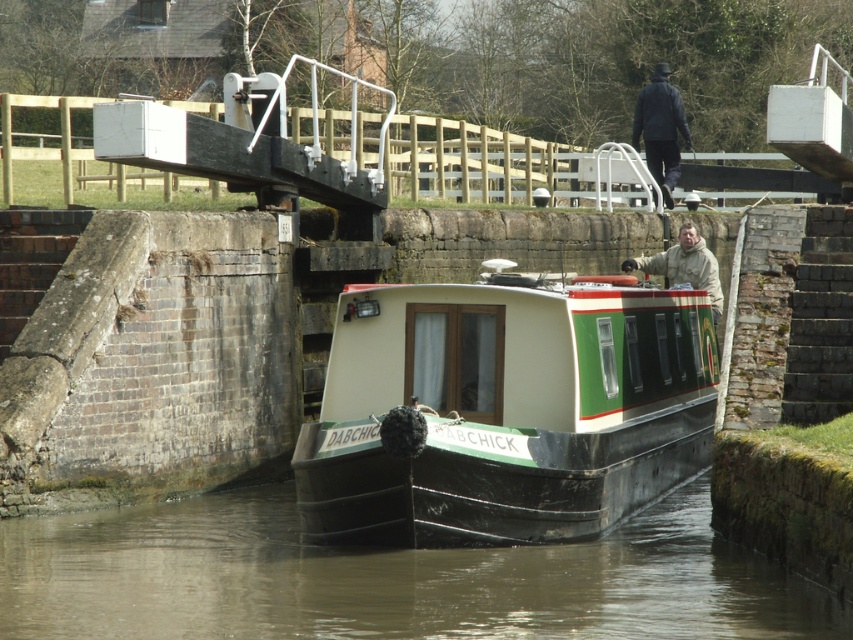
Consider the image. Does green matte houseboat at center appear under beige fuzzy jacket at upper center?

Yes.

Is green matte houseboat at center bigger than beige fuzzy jacket at upper center?

No.

Between point (479, 480) and point (662, 260), which one is positioned behind?

Positioned behind is point (662, 260).

Locate an element on the screen. green matte houseboat at center is located at coordinates (505, 410).

Is brown murky water at center wider than dark blue jacket at upper center?

Yes, brown murky water at center is wider than dark blue jacket at upper center.

Is point (675, 602) positioned after point (660, 90)?

No, (675, 602) is in front of (660, 90).

Between point (527, 556) and point (672, 177), which one is positioned behind?

Positioned behind is point (672, 177).

This screenshot has width=853, height=640. Find the location of `brown murky water at center`. brown murky water at center is located at coordinates (389, 579).

Does brown murky water at center lie in front of beige fuzzy jacket at upper center?

Yes, brown murky water at center is closer to the viewer.

Is brown murky water at center smaller than beige fuzzy jacket at upper center?

Actually, brown murky water at center might be larger than beige fuzzy jacket at upper center.

Image resolution: width=853 pixels, height=640 pixels. Find the location of `brown murky water at center`. brown murky water at center is located at coordinates (389, 579).

Where is `brown murky water at center`? The width and height of the screenshot is (853, 640). brown murky water at center is located at coordinates (389, 579).